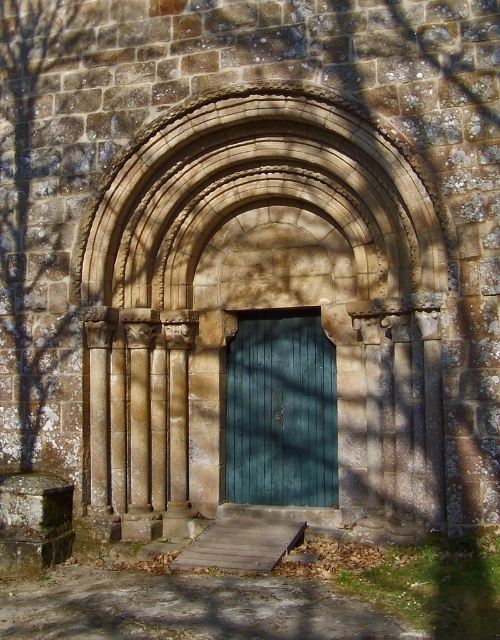
You are an architect analyzing the structure of the historical stone doorway. You notice a point at coordinates (x=260, y=196). What architectural feature does this point correspond to in the doorway?

The point at coordinates (x=260, y=196) corresponds to the stone textured arch at center.

Looking at this image, you are standing in front of the historical stone doorway. You notice the stone textured arch at center and the teal wooden door at center. Which object is positioned to the left side?

The stone textured arch at center is to the left of the teal wooden door at center.

You are an architect assessing the structural integrity of the stone textured arch at center and the teal wooden door at center. Which of these two elements has a greater height?

The stone textured arch at center has a greater height compared to the teal wooden door at center.